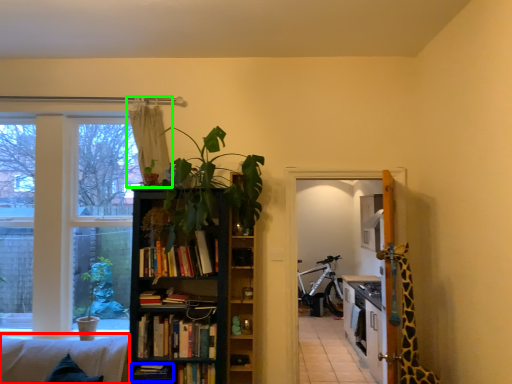
Question: Which object is positioned closest to couch (highlighted by a red box)? Select from book (highlighted by a blue box) and curtain (highlighted by a green box).

Choices:
 (A) book
 (B) curtain

Answer: (A)